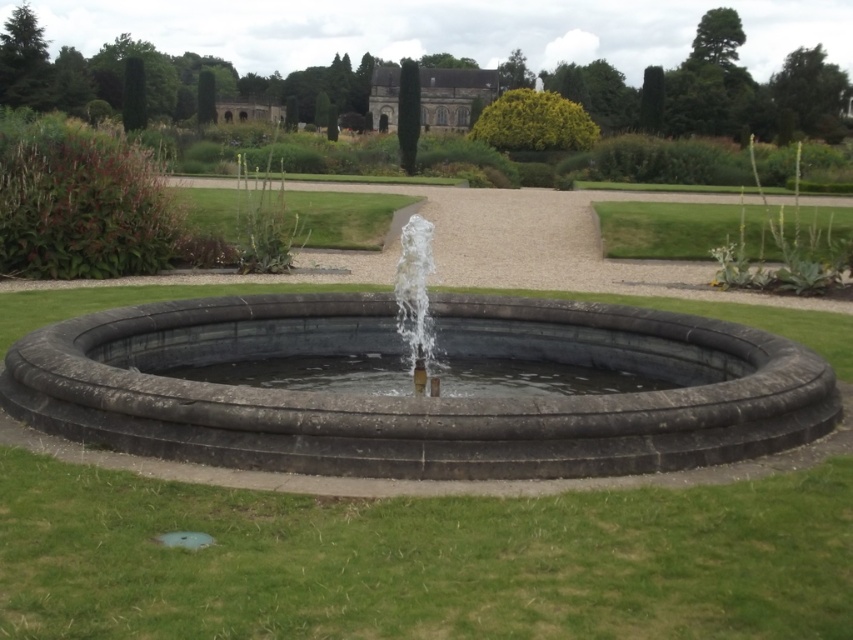
Is dark gray stone fountain at center closer to camera compared to clear stone water at center?

Yes.

Where is `dark gray stone fountain at center`? dark gray stone fountain at center is located at coordinates (419, 397).

You are a GUI agent. You are given a task and a screenshot of the screen. Output one action in this format:
    pyautogui.click(x=<x>, y=<y>)
    Task: Click on the dark gray stone fountain at center
    
    Given the screenshot: What is the action you would take?
    pos(419,397)